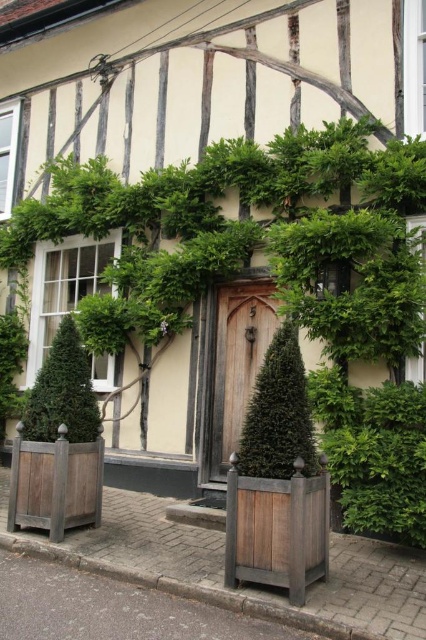
In the scene shown: Which of these two, green textured cone at center or wooden door at center, stands shorter?

green textured cone at center is shorter.

Which is behind, point (301, 376) or point (253, 307)?

The point (253, 307) is more distant.

Where is `green textured cone at center`? green textured cone at center is located at coordinates (279, 413).

How distant is green textured cone at center from green coniferous tree at left?

A distance of 2.05 meters exists between green textured cone at center and green coniferous tree at left.

Locate an element on the screen. green textured cone at center is located at coordinates (279, 413).

Consider the image. Measure the distance between green textured cone at center and camera.

The distance of green textured cone at center from camera is 4.64 meters.

Identify the location of green textured cone at center. (279, 413).

Looking at this image, is wooden door at center positioned before green coniferous tree at left?

No.

Who is more forward, (258, 355) or (71, 396)?

Point (71, 396) is in front.

At what (x,y) coordinates should I click in order to perform the action: click on wooden door at center. Please return your answer as a coordinate pair (x, y). Looking at the image, I should click on (238, 362).